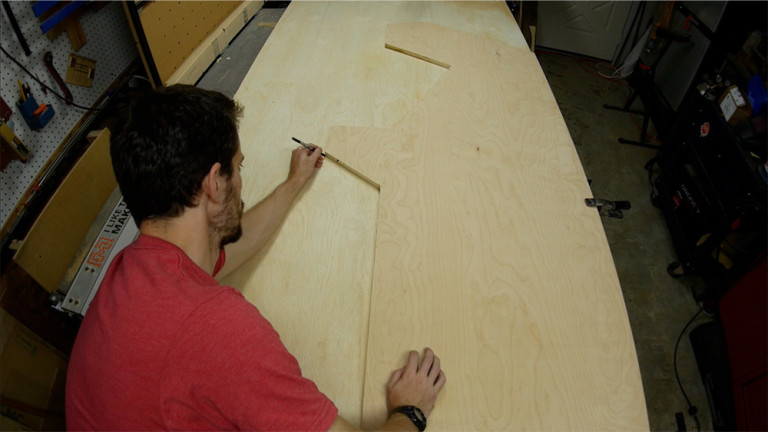
Locate an element on the screen. The height and width of the screenshot is (432, 768). work table is located at coordinates (245, 48).